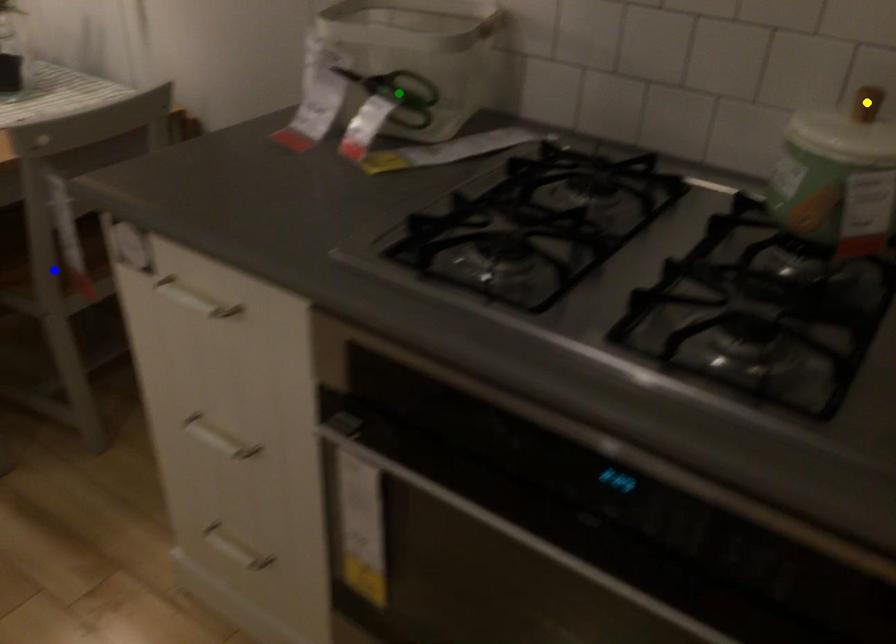
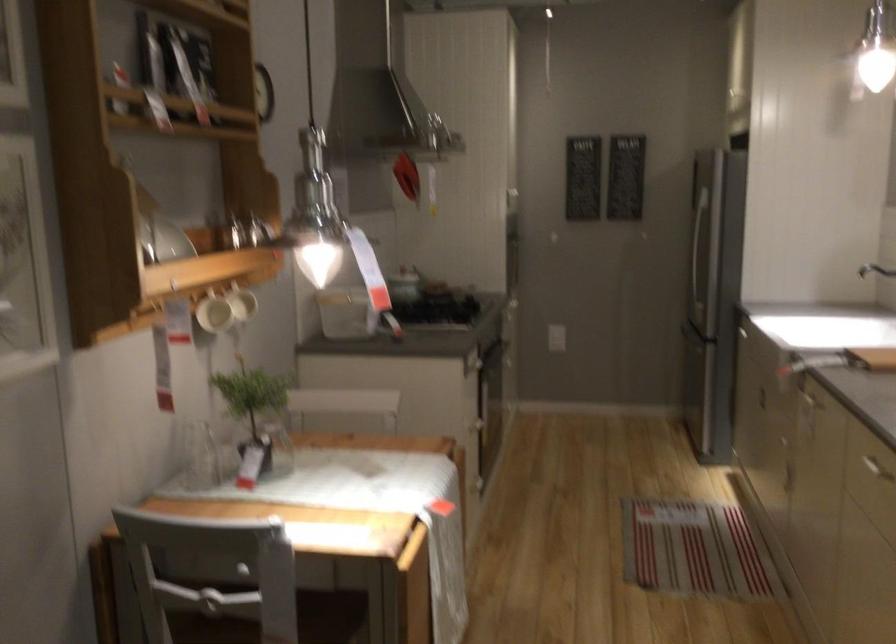
I am providing you with two images of the same scene from different viewpoints. Three points are marked in image1. Which point corresponds to a part or object that is occluded in image2?In image1, three points are marked. Which of them correspond to a part or object that is occluded in image2?Among the three points shown in image1, which one corresponds to a part or object that is no longer visible due to occlusion in image2?

Invisible in image2: green point, blue point, yellow point.